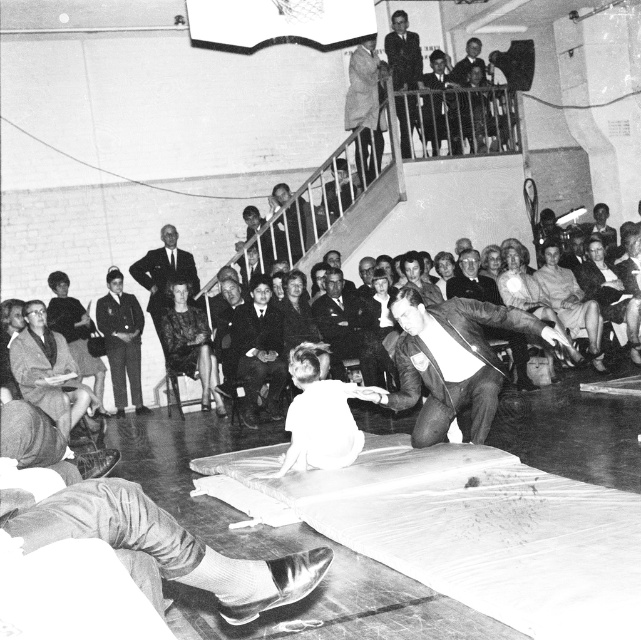
Which of these two, dark blue dress at center or smooth suit at center, stands shorter?

smooth suit at center

Is point (99, 332) farther from camera compared to point (187, 260)?

No, (99, 332) is in front of (187, 260).

Does point (117, 349) come closer to viewer compared to point (163, 291)?

Yes, it is.

Identify the location of dark blue dress at center. (121, 339).

Who is positioned more to the right, silky beige dress at center or smooth suit at center?

silky beige dress at center is more to the right.

Who is higher up, silky beige dress at center or smooth suit at center?

smooth suit at center is higher up.

Between point (565, 292) and point (154, 292), which one is positioned in front?

Point (565, 292) is more forward.

What are the coordinates of `silky beige dress at center` in the screenshot? It's located at (570, 304).

Can you confirm if dark gray suit at lower left is positioned to the right of smooth leather jacket at upper center?

In fact, dark gray suit at lower left is to the left of smooth leather jacket at upper center.

Can you confirm if dark gray suit at lower left is smaller than smooth leather jacket at upper center?

No, dark gray suit at lower left is not smaller than smooth leather jacket at upper center.

Where is `dark gray suit at lower left`? dark gray suit at lower left is located at coordinates (74, 332).